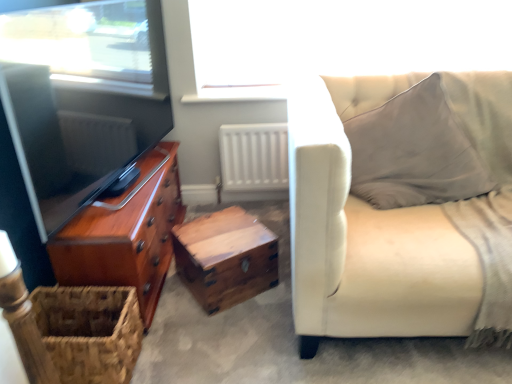
Question: Is white matte radiator at center in front of light beige fabric couch at right?

Choices:
 (A) yes
 (B) no

Answer: (B)

Question: From a real-world perspective, is white matte radiator at center below light beige fabric couch at right?

Choices:
 (A) no
 (B) yes

Answer: (B)

Question: Is white matte radiator at center not within light beige fabric couch at right?

Choices:
 (A) no
 (B) yes

Answer: (B)

Question: From the image's perspective, is white matte radiator at center on top of light beige fabric couch at right?

Choices:
 (A) yes
 (B) no

Answer: (A)

Question: Does white matte radiator at center appear on the right side of light beige fabric couch at right?

Choices:
 (A) no
 (B) yes

Answer: (A)

Question: From a real-world perspective, is light beige fabric couch at right positioned above or below shiny brown chest of drawers at left?

Choices:
 (A) below
 (B) above

Answer: (B)

Question: From their relative heights in the image, would you say light beige fabric couch at right is taller or shorter than shiny brown chest of drawers at left?

Choices:
 (A) short
 (B) tall

Answer: (B)

Question: Is point pyautogui.click(x=501, y=296) closer or farther from the camera than point pyautogui.click(x=175, y=168)?

Choices:
 (A) farther
 (B) closer

Answer: (B)

Question: Would you say light beige fabric couch at right is inside or outside shiny brown chest of drawers at left?

Choices:
 (A) inside
 (B) outside

Answer: (B)

Question: From a real-world perspective, is shiny brown chest of drawers at left physically located above or below wooden trunk at center?

Choices:
 (A) below
 (B) above

Answer: (B)

Question: Based on their positions, is shiny brown chest of drawers at left located to the left or right of wooden trunk at center?

Choices:
 (A) right
 (B) left

Answer: (B)

Question: Considering the positions of point (166, 264) and point (178, 251), is point (166, 264) closer or farther from the camera than point (178, 251)?

Choices:
 (A) farther
 (B) closer

Answer: (A)

Question: From the image's perspective, relative to wooden trunk at center, is shiny brown chest of drawers at left above or below?

Choices:
 (A) above
 (B) below

Answer: (A)

Question: In the image, is shiny brown chest of drawers at left positioned in front of or behind white matte radiator at center?

Choices:
 (A) behind
 (B) front

Answer: (B)

Question: Is shiny brown chest of drawers at left spatially inside white matte radiator at center, or outside of it?

Choices:
 (A) inside
 (B) outside

Answer: (B)